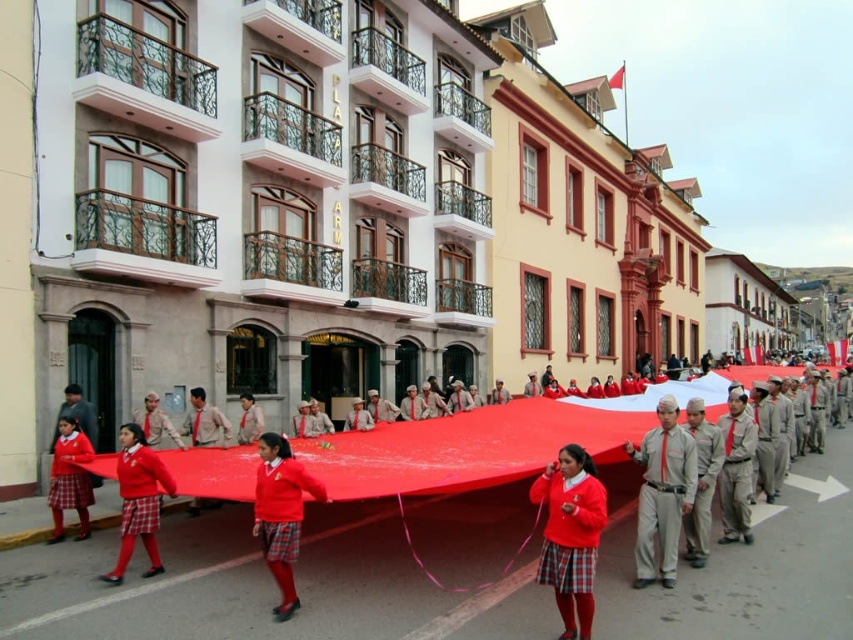
Question: From the image, what is the correct spatial relationship of matte red sweater at center in relation to matte khaki uniform at center?

Choices:
 (A) above
 (B) below

Answer: (B)

Question: Which point is farther to the camera?

Choices:
 (A) red matte sweater at center
 (B) khaki cotton pants at center

Answer: (B)

Question: From the image, what is the correct spatial relationship of matte red sweater at center in relation to matte red uniform at center?

Choices:
 (A) right
 (B) left

Answer: (A)

Question: Which object appears farthest from the camera in this image?

Choices:
 (A) matte red sweater at center
 (B) red plaid skirt at lower left

Answer: (B)

Question: Does red matte sweater at center lie behind red plaid skirt at lower left?

Choices:
 (A) no
 (B) yes

Answer: (A)

Question: Which point is closer to the camera?

Choices:
 (A) light gray cotton pants at center
 (B) matte red sweater at center

Answer: (B)